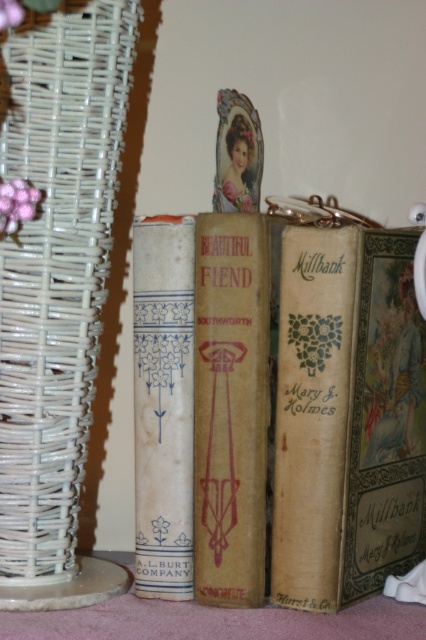
Does brown leather book at center have a greater width compared to blue paper book at center?

Indeed, brown leather book at center has a greater width compared to blue paper book at center.

Is point (261, 381) closer to viewer compared to point (176, 538)?

Yes, point (261, 381) is closer to viewer.

Identify the location of brown leather book at center. (305, 408).

Is brown leather book at center above matte brown book at center?

Yes, brown leather book at center is above matte brown book at center.

Does brown leather book at center appear on the right side of matte brown book at center?

Correct, you'll find brown leather book at center to the right of matte brown book at center.

Find the location of a particular element. This screenshot has height=640, width=426. brown leather book at center is located at coordinates (305, 408).

Locate an element on the screen. brown leather book at center is located at coordinates (305, 408).

Between brown leather book at center and white wicker basket at left, which one has more height?

white wicker basket at left is taller.

The width and height of the screenshot is (426, 640). What do you see at coordinates (305, 408) in the screenshot?
I see `brown leather book at center` at bounding box center [305, 408].

You are a GUI agent. You are given a task and a screenshot of the screen. Output one action in this format:
    pyautogui.click(x=<x>, y=<y>)
    Task: Click on the brown leather book at center
    The image size is (426, 640).
    Given the screenshot: What is the action you would take?
    pyautogui.click(x=305, y=408)